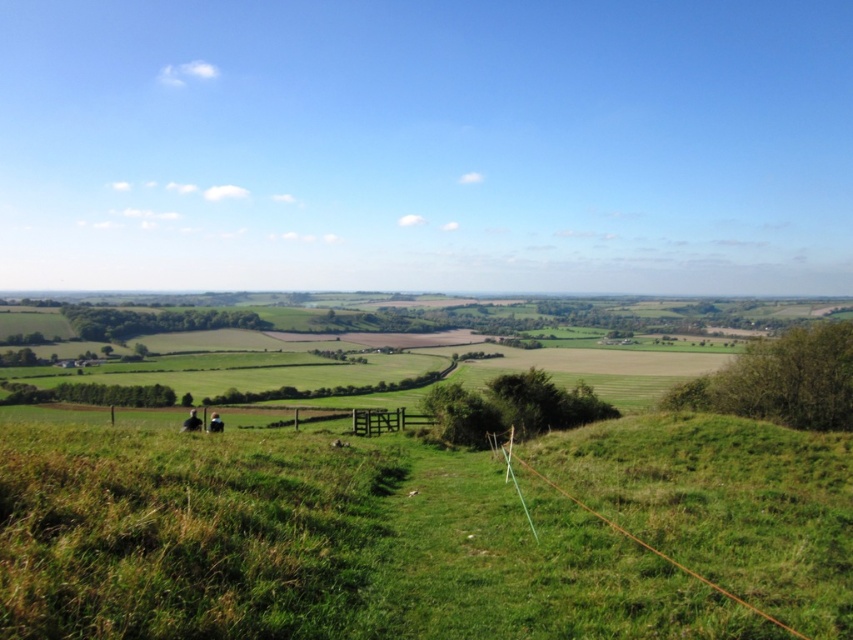
Question: Which point is farther to the camera?

Choices:
 (A) (354, 420)
 (B) (540, 536)

Answer: (A)

Question: Is green grassy hill at lower left bigger than green wooden fence at center?

Choices:
 (A) yes
 (B) no

Answer: (B)

Question: Does green grassy hill at lower left appear under green wooden fence at center?

Choices:
 (A) yes
 (B) no

Answer: (B)

Question: Does green grassy hill at lower left appear on the left side of green wooden fence at center?

Choices:
 (A) no
 (B) yes

Answer: (A)

Question: Among these points, which one is farthest from the camera?

Choices:
 (A) (192, 548)
 (B) (393, 432)

Answer: (B)